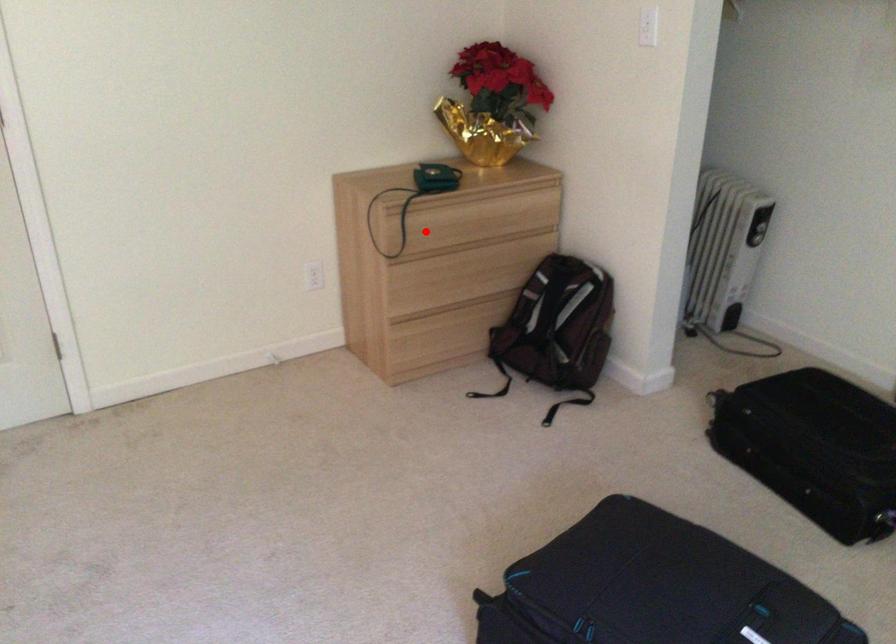
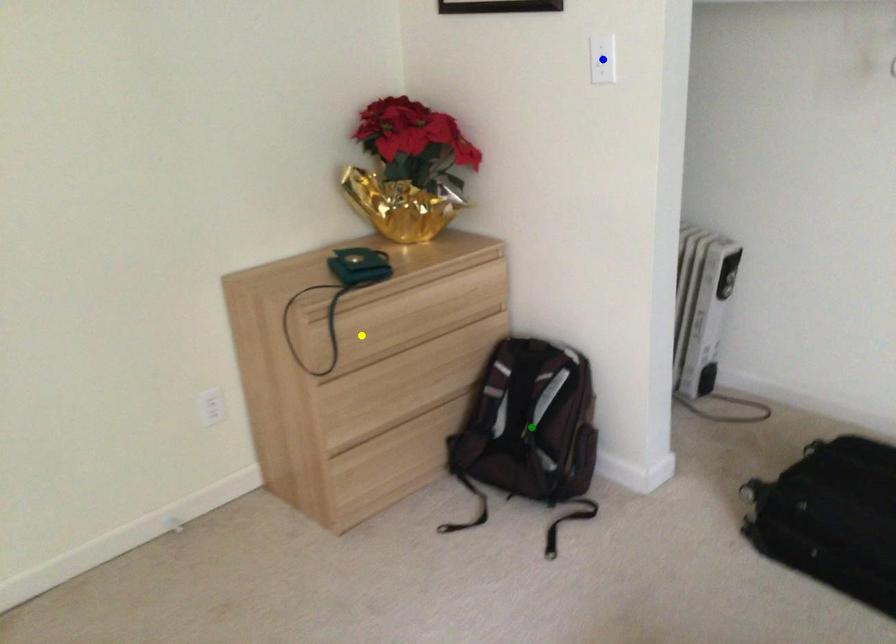
Question: I am providing you with two images of the same scene from different viewpoints. A red point is marked on the first image. You are given multiple points on the second image. Which point in image 2 is actually the same real-world point as the red point in image 1?

Choices:
 (A) blue point
 (B) yellow point
 (C) green point

Answer: (B)